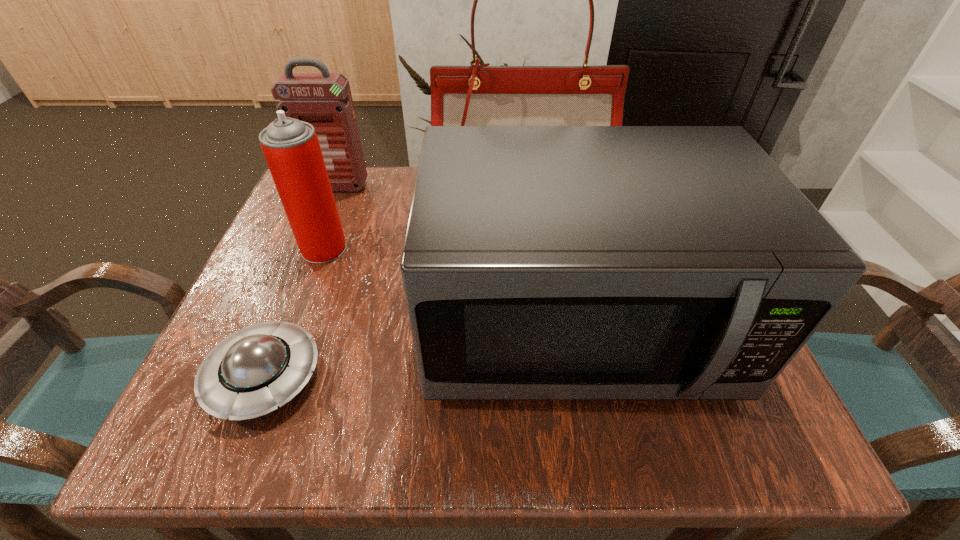
Identify the location of the tallest object. This screenshot has height=540, width=960. (478, 95).

This screenshot has width=960, height=540. Identify the location of the first-aid kit. (324, 100).

You are a GUI agent. You are given a task and a screenshot of the screen. Output one action in this format:
    pyautogui.click(x=<x>, y=<y>)
    Task: Click on the aerosol can
    The width and height of the screenshot is (960, 540).
    Given the screenshot: What is the action you would take?
    pyautogui.click(x=291, y=147)

You are a GUI agent. You are given a task and a screenshot of the screen. Output one action in this format:
    pyautogui.click(x=<x>, y=<y>)
    Task: Click on the microwave oven
    This screenshot has width=960, height=540.
    Given the screenshot: What is the action you would take?
    pyautogui.click(x=540, y=262)

Where is `saucer`? The image size is (960, 540). saucer is located at coordinates (250, 373).

You are a GUI agent. You are given a task and a screenshot of the screen. Output one action in this format:
    pyautogui.click(x=<x>, y=<y>)
    Task: Click on the blank space located on the left of the tallest object
    The width and height of the screenshot is (960, 540).
    Given the screenshot: What is the action you would take?
    pyautogui.click(x=390, y=185)

You are a GUI agent. You are given a task and a screenshot of the screen. Output one action in this format:
    pyautogui.click(x=<x>, y=<y>)
    Task: Click on the free point located 0.260m on the front-facing side of the first-aid kit
    Image resolution: width=960 pixels, height=540 pixels.
    Given the screenshot: What is the action you would take?
    pyautogui.click(x=303, y=268)

At what (x,y) coordinates should I click in order to perform the action: click on vacant space located on the right of the aerosol can. Please return your answer as a coordinate pair (x, y). The height and width of the screenshot is (540, 960). Looking at the image, I should click on (540, 248).

Locate an element on the screen. The width and height of the screenshot is (960, 540). vacant region located on the back of the saucer is located at coordinates (316, 248).

The height and width of the screenshot is (540, 960). I want to click on handbag located in the far edge section of the desktop, so point(478,95).